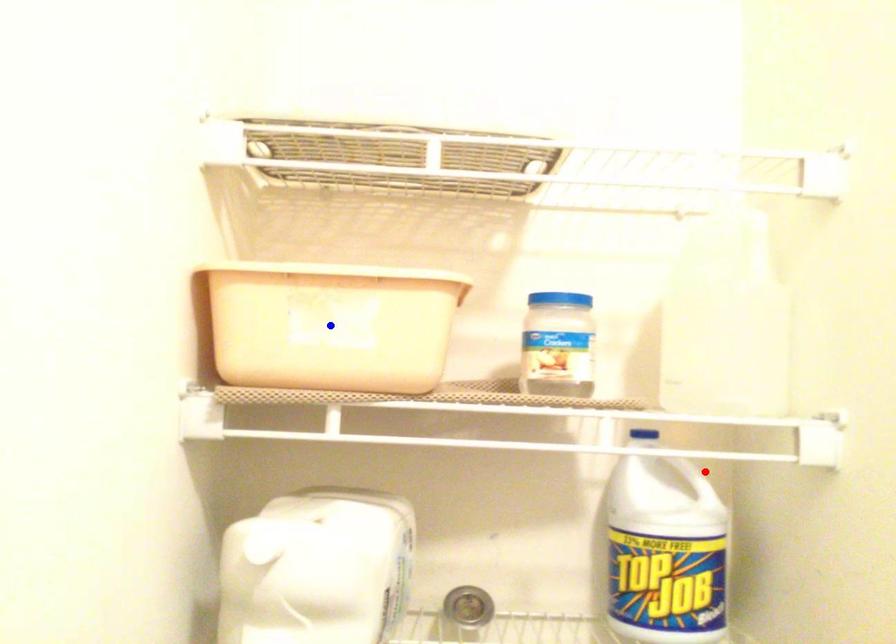
Question: Which of the two points in the image is closer to the camera?

Choices:
 (A) Blue point is closer.
 (B) Red point is closer.

Answer: (A)